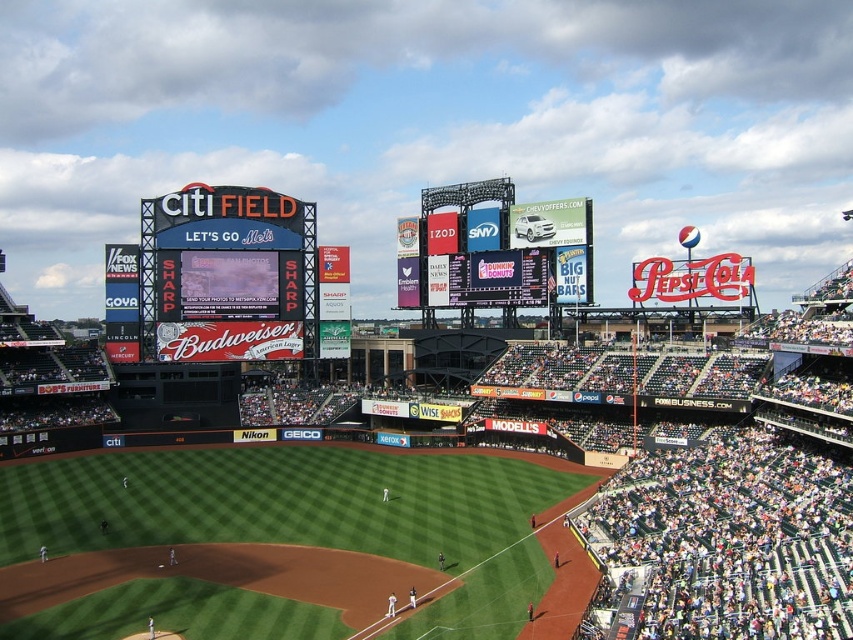
Can you confirm if green grass at center is wider than blue digital scoreboard at center?

Yes.

Does green grass at center have a lesser width compared to blue digital scoreboard at center?

No.

Which is behind, point (194, 476) or point (560, 298)?

Point (560, 298)

The image size is (853, 640). Identify the location of green grass at center. (276, 541).

Does matte black scoreboard at upper left appear on the right side of blue digital scoreboard at center?

In fact, matte black scoreboard at upper left is to the left of blue digital scoreboard at center.

Does matte black scoreboard at upper left have a lesser width compared to blue digital scoreboard at center?

Yes.

Does point (258, 200) come farther from viewer compared to point (532, 220)?

Yes, it is.

Find the location of a particular element. This screenshot has height=640, width=853. matte black scoreboard at upper left is located at coordinates (228, 275).

Does point (538, 544) come closer to viewer compared to point (144, 352)?

That is True.

Is point (42, 477) less distant than point (276, 202)?

Yes.

Where is `green grass at center`? Image resolution: width=853 pixels, height=640 pixels. green grass at center is located at coordinates (276, 541).